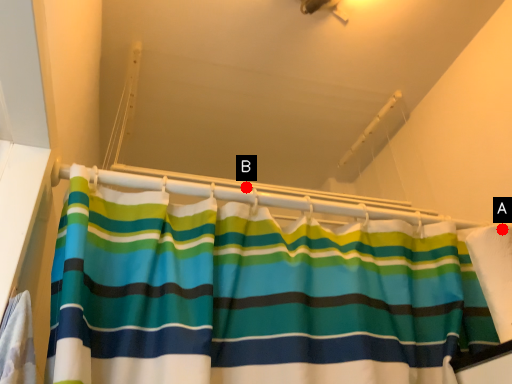
Question: Two points are circled on the image, labeled by A and B beside each circle. Which point is closer to the camera taking this photo?

Choices:
 (A) A is closer
 (B) B is closer

Answer: (A)